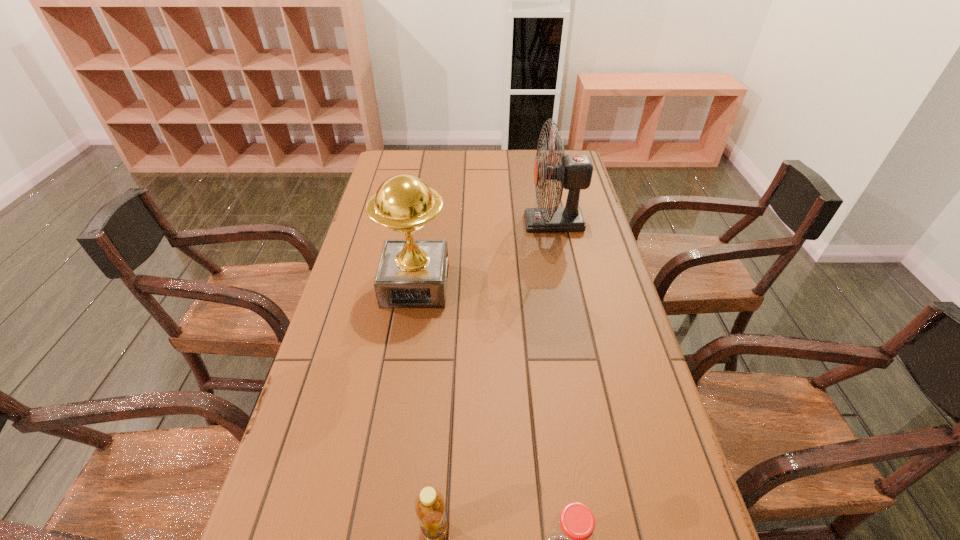
This screenshot has width=960, height=540. I want to click on fan, so tap(574, 173).

You are a GUI agent. You are given a task and a screenshot of the screen. Output one action in this format:
    pyautogui.click(x=<x>, y=<y>)
    Task: Click on the award
    The height and width of the screenshot is (540, 960).
    Given the screenshot: What is the action you would take?
    pyautogui.click(x=411, y=273)

What are the coordinates of `vacant space situated 0.210m on the front-facing side of the farthest object` in the screenshot? It's located at (x=463, y=222).

You are a GUI agent. You are given a task and a screenshot of the screen. Output one action in this format:
    pyautogui.click(x=<x>, y=<y>)
    Task: Click on the vacant point located 0.250m on the front-facing side of the farthest object
    This screenshot has height=540, width=960.
    Given the screenshot: What is the action you would take?
    tap(451, 222)

At what (x,y) coordinates should I click in order to perform the action: click on free region located on the front-facing side of the farthest object. Please return your answer as a coordinate pair (x, y). This screenshot has width=960, height=540. Looking at the image, I should click on [478, 222].

The image size is (960, 540). What are the coordinates of `vacant space situated on the front-facing side of the second farthest object` in the screenshot? It's located at (391, 448).

You are a GUI agent. You are given a task and a screenshot of the screen. Output one action in this format:
    pyautogui.click(x=<x>, y=<y>)
    Task: Click on the object located at the left edge
    
    Given the screenshot: What is the action you would take?
    pyautogui.click(x=411, y=273)

The height and width of the screenshot is (540, 960). I want to click on object that is at the right edge, so click(x=574, y=173).

The height and width of the screenshot is (540, 960). In the image, there is a desktop. What are the coordinates of `vacant area at the far edge` in the screenshot? It's located at (464, 167).

You are a GUI agent. You are given a task and a screenshot of the screen. Output one action in this format:
    pyautogui.click(x=<x>, y=<y>)
    Task: Click on the free space at the left edge
    The height and width of the screenshot is (540, 960).
    Given the screenshot: What is the action you would take?
    pyautogui.click(x=264, y=512)